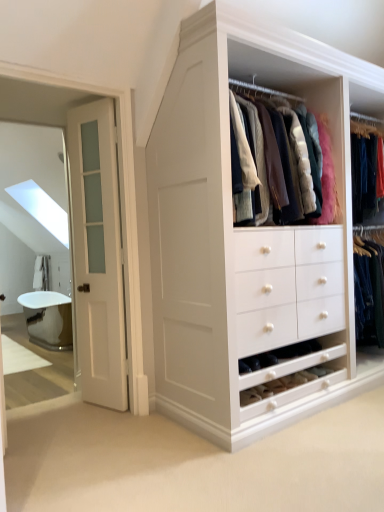
Question: Is silver metallic bathtub at left situated inside white frosted glass door at left or outside?

Choices:
 (A) outside
 (B) inside

Answer: (A)

Question: From a real-world perspective, relative to white frosted glass door at left, is silver metallic bathtub at left vertically above or below?

Choices:
 (A) above
 (B) below

Answer: (B)

Question: Considering the positions of silver metallic bathtub at left and white frosted glass door at left in the image, is silver metallic bathtub at left bigger or smaller than white frosted glass door at left?

Choices:
 (A) big
 (B) small

Answer: (A)

Question: Is white frosted glass door at left inside the boundaries of silver metallic bathtub at left, or outside?

Choices:
 (A) inside
 (B) outside

Answer: (B)

Question: Is white frosted glass door at left taller or shorter than silver metallic bathtub at left?

Choices:
 (A) tall
 (B) short

Answer: (A)

Question: Would you say white frosted glass door at left is to the left or to the right of silver metallic bathtub at left in the picture?

Choices:
 (A) left
 (B) right

Answer: (B)

Question: From the image's perspective, is white frosted glass door at left above or below silver metallic bathtub at left?

Choices:
 (A) below
 (B) above

Answer: (B)